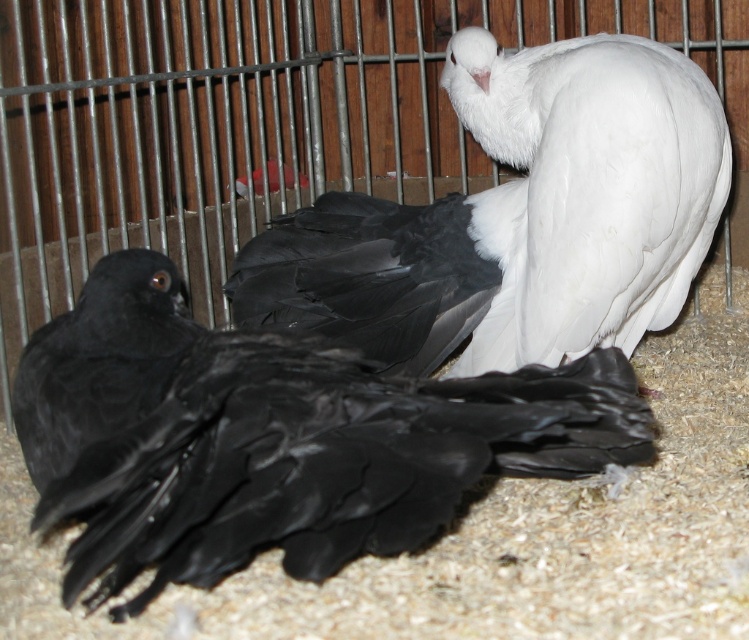
Question: Among these objects, which one is nearest to the camera?

Choices:
 (A) black glossy feathers at center
 (B) white feathered bird at upper right

Answer: (A)

Question: Among these points, which one is farthest from the camera?

Choices:
 (A) (706, 80)
 (B) (201, 577)

Answer: (A)

Question: Which object appears closest to the camera in this image?

Choices:
 (A) white feathered bird at upper right
 (B) black glossy feathers at center

Answer: (B)

Question: Does black glossy feathers at center appear on the right side of white feathered bird at upper right?

Choices:
 (A) no
 (B) yes

Answer: (A)

Question: Is black glossy feathers at center above white feathered bird at upper right?

Choices:
 (A) no
 (B) yes

Answer: (A)

Question: Can you confirm if black glossy feathers at center is bigger than white feathered bird at upper right?

Choices:
 (A) yes
 (B) no

Answer: (B)